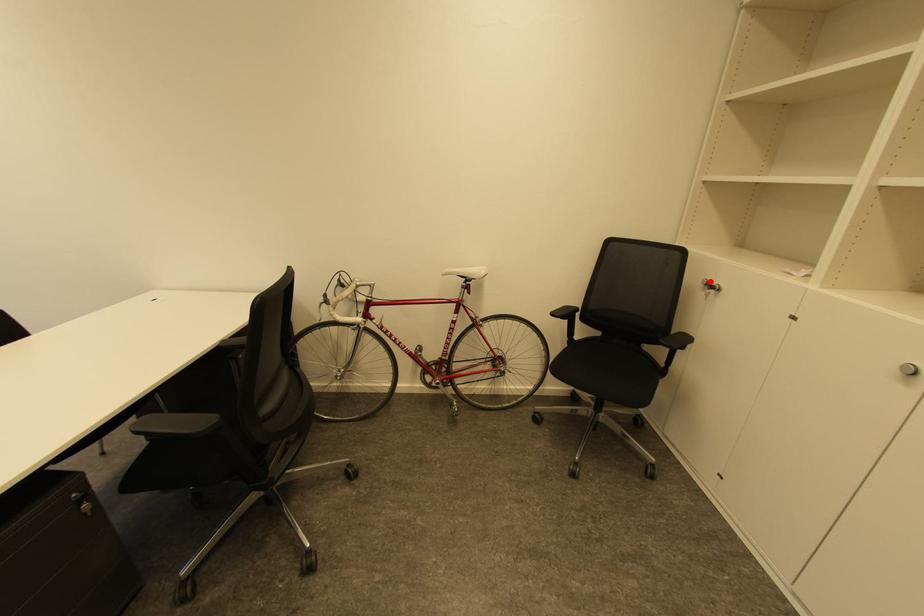
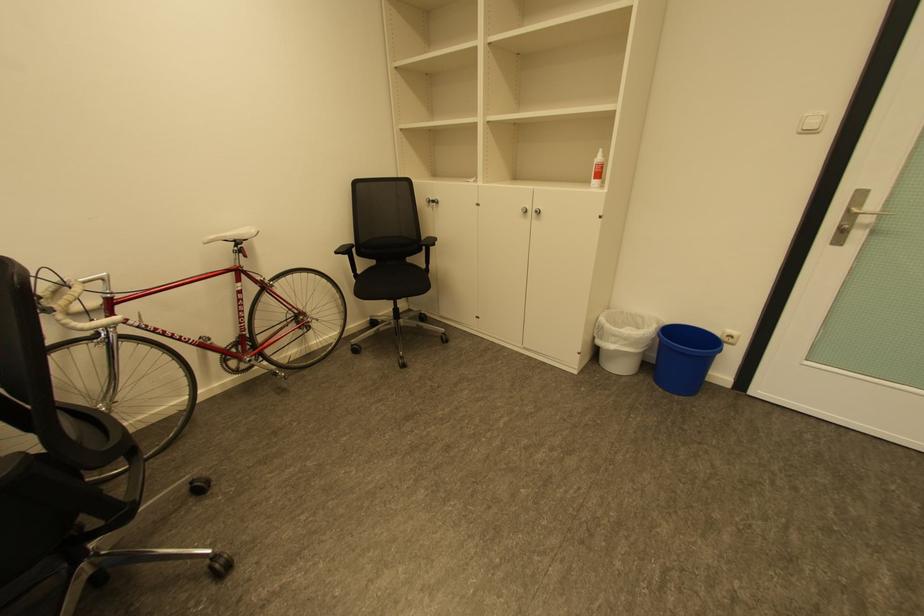
The point at the highlighted location is marked in the first image. Where is the corresponding point in the second image?

(433, 200)